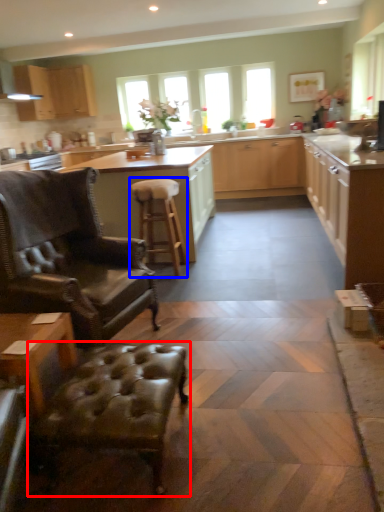
Question: Which object is further to the camera taking this photo, swivel chair (highlighted by a red box) or stool (highlighted by a blue box)?

Choices:
 (A) swivel chair
 (B) stool

Answer: (B)